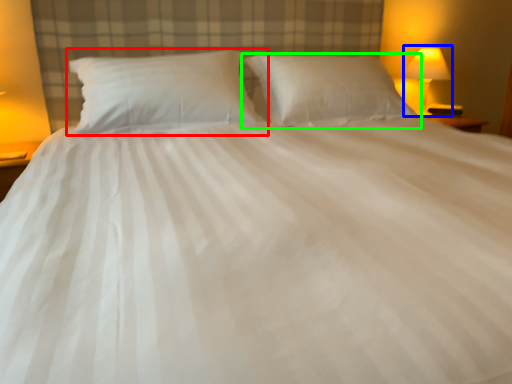
Question: Which is nearer to the pillow (highlighted by a red box)? bedside lamp (highlighted by a blue box) or pillow (highlighted by a green box).

Choices:
 (A) bedside lamp
 (B) pillow

Answer: (B)